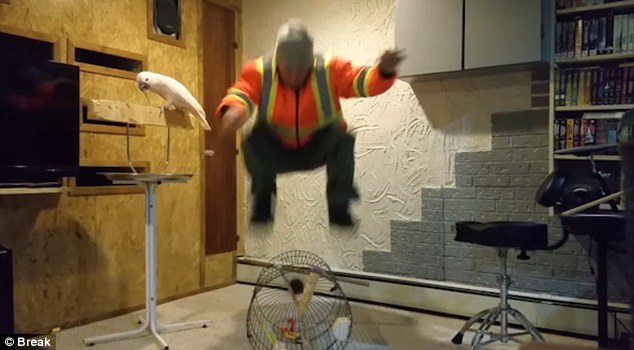
Where is `black stool cushion`? The width and height of the screenshot is (634, 350). black stool cushion is located at coordinates (518, 230).